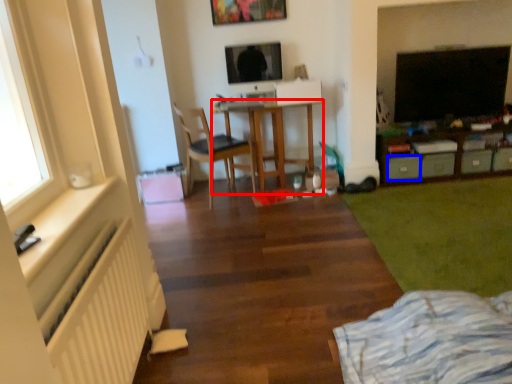
Question: Which object is further to the camera taking this photo, desk (highlighted by a red box) or drawer (highlighted by a blue box)?

Choices:
 (A) desk
 (B) drawer

Answer: (B)